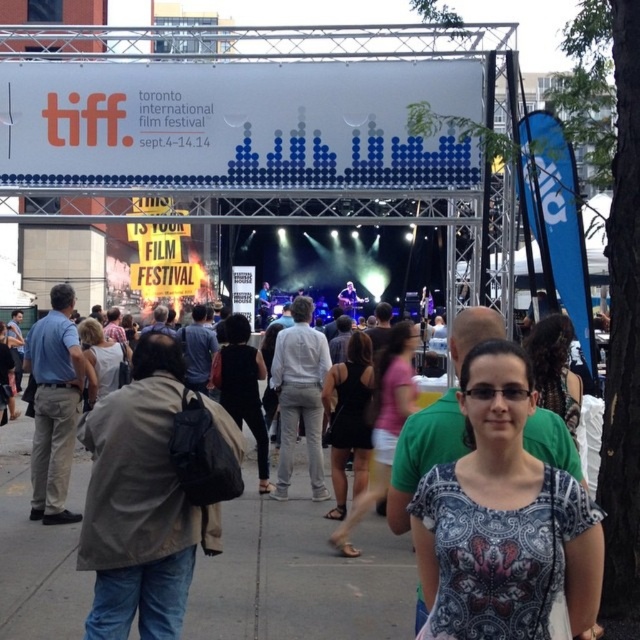
You are a photographer at the TIFF event and need to capture a clear shot of both the white cotton shirt at center and the black dress at center. Based on their positions, which one is closer to the camera?

The white cotton shirt at center is in front of the black dress at center, so it is closer to the camera.

You are a photographer at the TIFF festival and want to capture a clear photo of both the matte black tank top at center and the matte black sunglasses at center. Since you want both items to be visible, which one should you focus on first to ensure it doesn t get too small in the frame?

The matte black tank top at center is larger in size than the matte black sunglasses at center, so you should focus on the matte black tank top at center first to ensure it doesn t get too small in the frame.